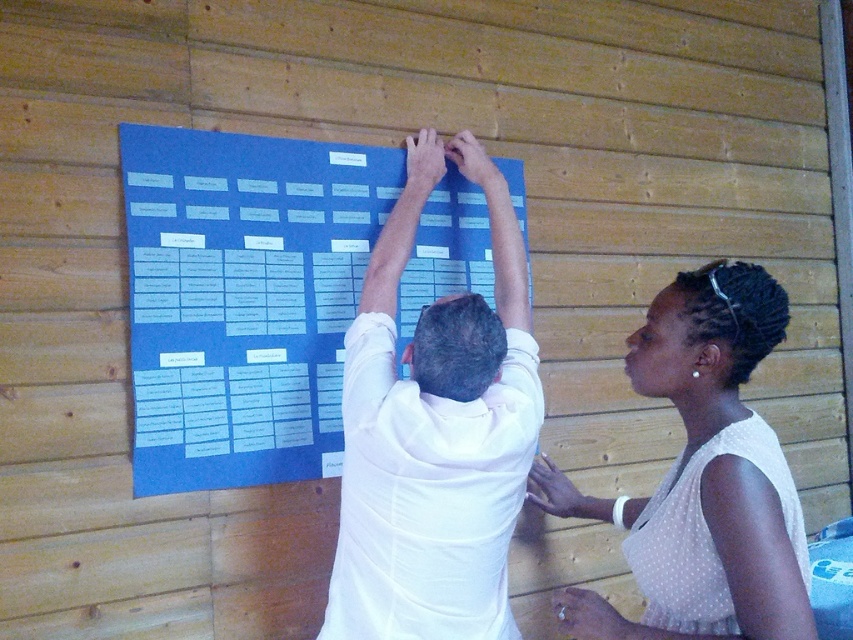
Question: Which object is the closest to the white dotted blouse at upper right?

Choices:
 (A) white matte shirt at center
 (B) blue paperboard at center

Answer: (A)

Question: Which point is farther to the camera?

Choices:
 (A) (164, 342)
 (B) (489, 164)

Answer: (B)

Question: Is blue paperboard at center thinner than white dotted blouse at upper right?

Choices:
 (A) no
 (B) yes

Answer: (A)

Question: Is the position of white matte shirt at center less distant than that of white dotted blouse at upper right?

Choices:
 (A) yes
 (B) no

Answer: (B)

Question: Which point is farther to the camera?

Choices:
 (A) blue paperboard at center
 (B) white matte shirt at center

Answer: (A)

Question: Is blue paperboard at center to the left of white matte shirt at center from the viewer's perspective?

Choices:
 (A) no
 (B) yes

Answer: (B)